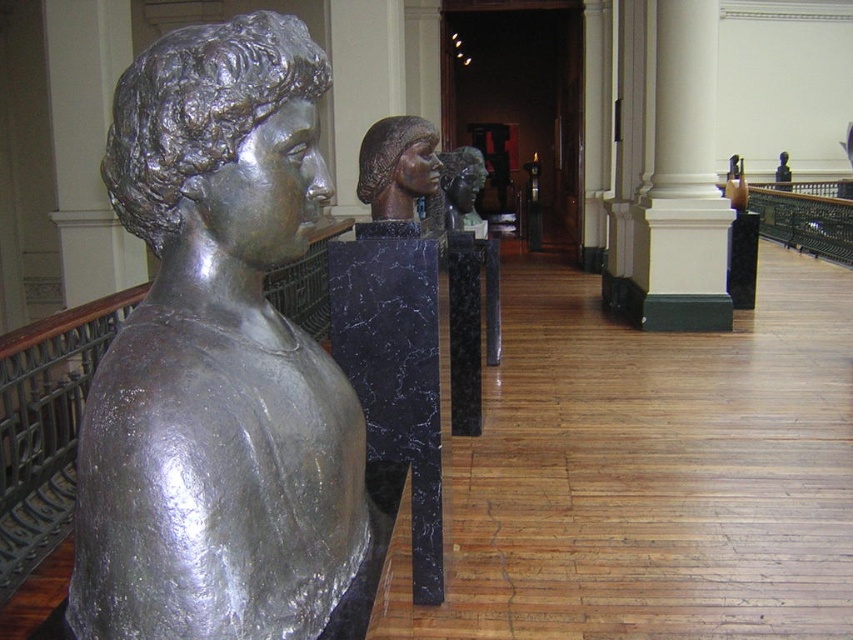
You are an art curator planning to rearrange the sculptures in the museum. You want to place a new sculpture that is smaller than the shiny silver bust at left but larger than the polished bronze bust at center. Is there a suitable space between them to accommodate this new sculpture?

The shiny silver bust at left is larger than the polished bronze bust at center. Therefore, a new sculpture smaller than the shiny silver bust at left but larger than the polished bronze bust at center can fit between them as there is a size difference available.